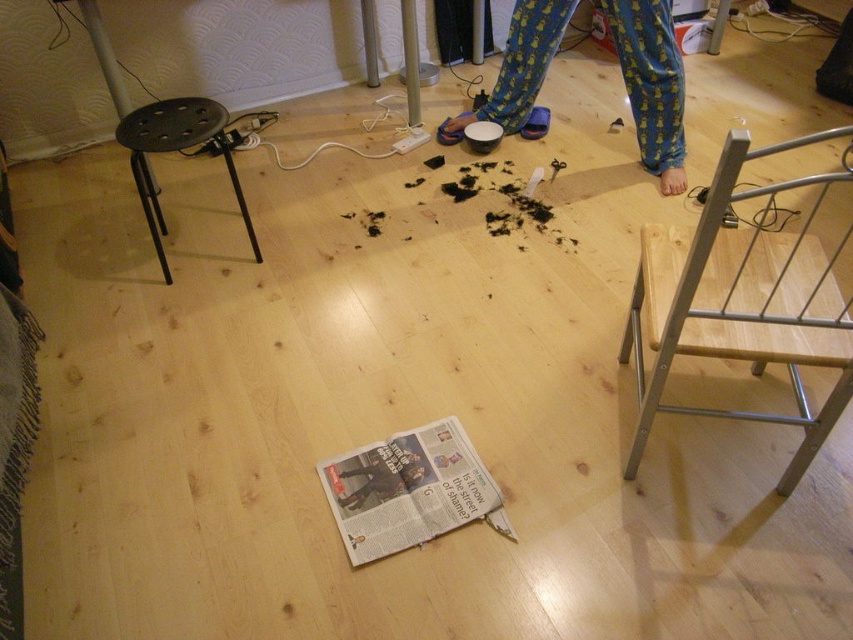
Question: Observing the image, what is the correct spatial positioning of white glossy newspaper at center in reference to blue cotton pajama pants at center?

Choices:
 (A) above
 (B) below

Answer: (B)

Question: Does white glossy newspaper at center appear under blue cotton pajama pants at center?

Choices:
 (A) yes
 (B) no

Answer: (A)

Question: Which point is farther from the camera taking this photo?

Choices:
 (A) (396, 474)
 (B) (187, 122)

Answer: (B)

Question: Which of these objects is positioned closest to the white glossy newspaper at center?

Choices:
 (A) dark gray fabric pants at center
 (B) blue cotton pajama pants at center
 (C) black plastic stool at left

Answer: (A)

Question: Among these points, which one is nearest to the camera?

Choices:
 (A) (648, 8)
 (B) (206, 138)
 (C) (354, 468)

Answer: (C)

Question: Is white glossy newspaper at center below black plastic stool at left?

Choices:
 (A) yes
 (B) no

Answer: (A)